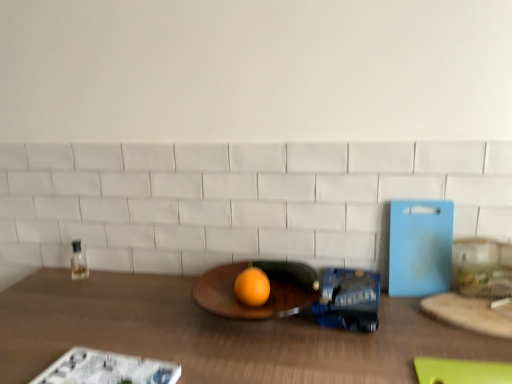
This screenshot has width=512, height=384. I want to click on blank space to the left of orange matte grapefruit at center, so click(172, 314).